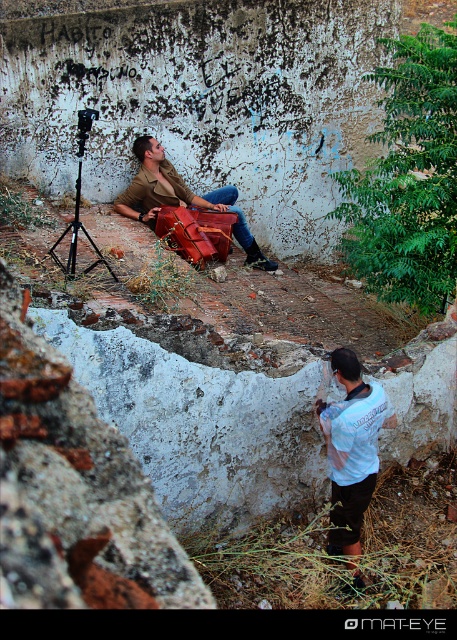
You are a photographer setting up equipment in the scene. You have a leather suitcase at center and a black matte tripod at center. Which object is positioned higher relative to the other?

The leather suitcase at center is located above the black matte tripod at center, so it is positioned higher.